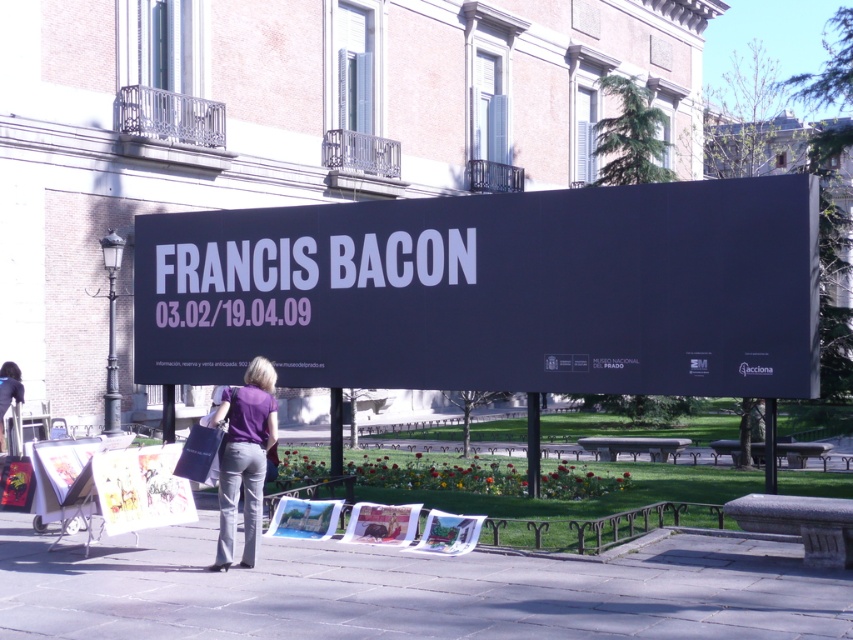
You are standing in front of the Francis Bacon exhibition billboard. You notice a matte black bag at lower left and a smooth concrete pavement at lower center. Which object is positioned lower in the image?

The smooth concrete pavement at lower center is positioned lower than the matte black bag at lower left in the image.

You are a tourist looking for the exhibition entrance. You see the black matte sign at center and the matte paper posters at lower left. Which one is closer to your right side?

The black matte sign at center is to the right of matte paper posters at lower left, so if you are facing the scene, the black matte sign at center would be closer to your right side.

You are standing in front of the billboard and want to step onto the smooth concrete pavement at lower center. Is the black matte sign at center blocking your path?

The black matte sign at center is further to the viewer than the smooth concrete pavement at lower center, so it is blocking your path.